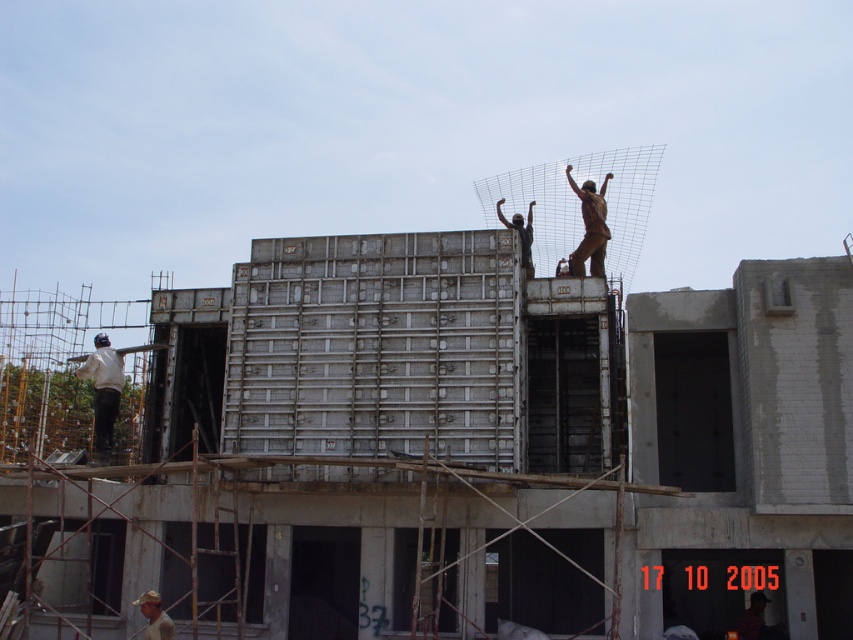
You are a safety inspector at the construction site shown in the image. You need to locate the tan fabric cap at lower left. Where exactly is it positioned in the image?

The tan fabric cap at lower left is positioned at point coordinates of 0.964 on the x axis and 0.182 on the y axis.

You are a crane operator trying to lift the bronze statue at upper right and the tan fabric cap at lower left. The crane can only lift one object at a time. Which object should you lift first if you need to place them both in a storage container that has limited width?

The bronze statue at upper right might be wider than tan fabric cap at lower left, so you should lift the bronze statue at upper right first to ensure it fits in the storage container.